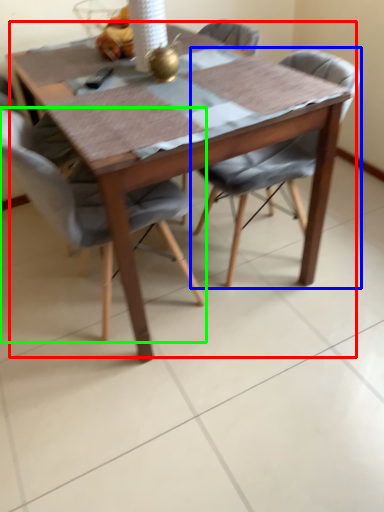
Question: Which object is the farthest from kitchen & dining room table (highlighted by a red box)? Choose among these: chair (highlighted by a blue box) or chair (highlighted by a green box).

Choices:
 (A) chair
 (B) chair

Answer: (A)